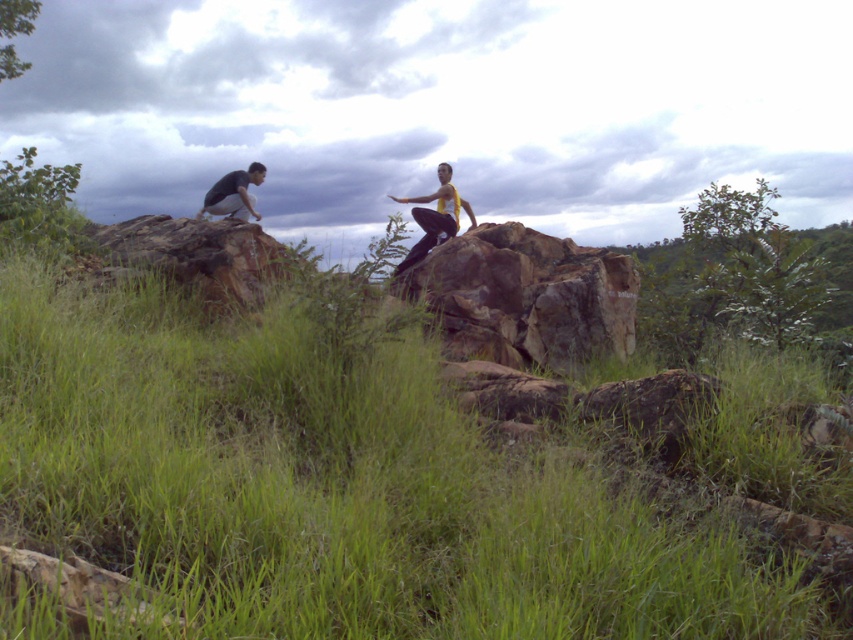
You are planning to place a small flag on the highest point between the rusty stone at center and the brown rough rock at left. Which object should you choose for the flag placement?

The brown rough rock at left is higher than the rusty stone at center, so you should place the flag on the brown rough rock at left.

You are planning to place a small flag between the rusty stone at center and the brown rough rock at left. Which object should you place the flag closer to if you want it to be more visible from your current position?

You should place the flag closer to the rusty stone at center because it is closer to you than the brown rough rock at left, making it more visible from your current position.

Based on the scene description, what is located at the coordinates point (379,477)?

The green grassy area at center is located at point (379,477).